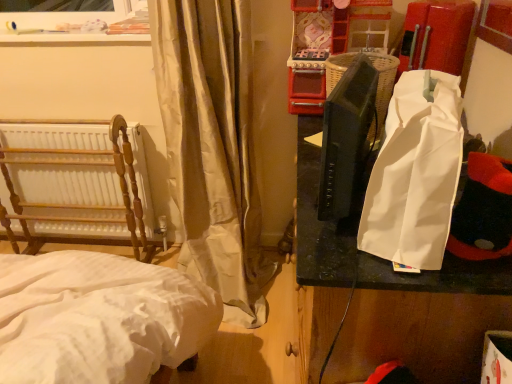
Describe the element at coordinates (75, 181) in the screenshot. I see `wooden radiator at left` at that location.

Where is `wooden radiator at left`? The width and height of the screenshot is (512, 384). wooden radiator at left is located at coordinates (75, 181).

Consider the image. In order to face white paper bag at right, should I rotate leftwards or rightwards?

Turn right by 20.603 degrees to look at white paper bag at right.

I want to click on wooden radiator at left, so click(75, 181).

Could you tell me if silky beige curtain at left is facing white paper bag at right?

No, silky beige curtain at left is not oriented towards white paper bag at right.

In terms of width, does silky beige curtain at left look wider or thinner when compared to white paper bag at right?

Clearly, silky beige curtain at left has more width compared to white paper bag at right.

Which of these two, silky beige curtain at left or white paper bag at right, is smaller?

white paper bag at right is smaller.

Looking at this image, is silky beige curtain at left taller or shorter than white paper bag at right?

Considering their sizes, silky beige curtain at left has more height than white paper bag at right.

Is white paper bag at right completely or partially outside of white paper bag at right?

Indeed, white paper bag at right is completely outside white paper bag at right.

Is the surface of white paper bag at right in direct contact with white paper bag at right?

No, white paper bag at right is not next to white paper bag at right.

Identify the location of table that appears on the right of white paper bag at right. This screenshot has height=384, width=512. (423, 319).

From a real-world perspective, is wooden radiator at left physically above silky beige curtain at left?

Actually, wooden radiator at left is physically below silky beige curtain at left in the real world.

Find the location of a particular element. furniture behind the silky beige curtain at left is located at coordinates (75, 181).

Is wooden radiator at left in front of or behind silky beige curtain at left in the image?

wooden radiator at left is positioned farther from the viewer than silky beige curtain at left.

Which object is thinner, wooden radiator at left or silky beige curtain at left?

Thinner between the two is wooden radiator at left.

Is wooden radiator at left in front of white paper bag at right?

No, wooden radiator at left is further to the viewer.

Does wooden radiator at left have a lesser width compared to white paper bag at right?

Correct, the width of wooden radiator at left is less than that of white paper bag at right.

From a real-world perspective, relative to white paper bag at right, is wooden radiator at left vertically above or below?

In terms of real-world spatial position, wooden radiator at left is below white paper bag at right.

Are wooden radiator at left and white paper bag at right far apart?

Yes.

Looking at this image, from a real-world perspective, is silky beige curtain at left above or below wooden radiator at left?

From a real-world perspective, silky beige curtain at left is physically above wooden radiator at left.

Looking at this image, is silky beige curtain at left oriented away from wooden radiator at left?

No, wooden radiator at left is not at the back of silky beige curtain at left.

Is the depth of silky beige curtain at left less than that of wooden radiator at left?

Yes, silky beige curtain at left is closer to the viewer.

How many degrees apart are the facing directions of silky beige curtain at left and wooden radiator at left?

There is a 0.114-degree angle between the facing directions of silky beige curtain at left and wooden radiator at left.

From the picture: Who is taller, white paper bag at right or white paper bag at right?

Standing taller between the two is white paper bag at right.

From a real-world perspective, is white paper bag at right below white paper bag at right?

Incorrect, from a real-world perspective, white paper bag at right is higher than white paper bag at right.

Is point (423, 228) less distant than point (505, 284)?

Yes, it is in front of point (505, 284).

Find the location of a particular element. Image resolution: width=512 pixels, height=384 pixels. table below the white paper bag at right (from the image's perspective) is located at coordinates (423, 319).

Does point (124, 192) come farther from viewer compared to point (384, 173)?

Yes, it is behind point (384, 173).

From the image's perspective, would you say wooden radiator at left is positioned over white paper bag at right?

No, from the image's perspective, wooden radiator at left is not above white paper bag at right.

From a real-world perspective, which is physically below, wooden radiator at left or white paper bag at right?

wooden radiator at left.

Locate an element on the screen. shopping bag lying on the right of silky beige curtain at left is located at coordinates (415, 173).

Identify the location of shopping bag above the white paper bag at right (from a real-world perspective). (415, 173).

From the image, which object appears to be farther from silky beige curtain at left, wooden radiator at left or white paper bag at right?

white paper bag at right lies further to silky beige curtain at left than the other object.

Estimate the real-world distances between objects in this image. Which object is further from silky beige curtain at left, white paper bag at right or white paper bag at right?

white paper bag at right lies further to silky beige curtain at left than the other object.

From the image, which object appears to be nearer to white paper bag at right, white paper bag at right or wooden radiator at left?

white paper bag at right lies closer to white paper bag at right than the other object.

From the image, which object appears to be farther from wooden radiator at left, silky beige curtain at left or white paper bag at right?

Based on the image, white paper bag at right appears to be further to wooden radiator at left.

In the scene shown: From the image, which object appears to be farther from white paper bag at right, silky beige curtain at left or wooden radiator at left?

wooden radiator at left is further to white paper bag at right.

Considering their positions, is white paper bag at right positioned closer to wooden radiator at left than white paper bag at right?

Among the two, white paper bag at right is located nearer to wooden radiator at left.

Estimate the real-world distances between objects in this image. Which object is closer to white paper bag at right, wooden radiator at left or white paper bag at right?

white paper bag at right is positioned closer to the anchor white paper bag at right.

From the image, which object appears to be nearer to white paper bag at right, white paper bag at right or wooden radiator at left?

white paper bag at right lies closer to white paper bag at right than the other object.

The image size is (512, 384). I want to click on curtain situated between wooden radiator at left and white paper bag at right from left to right, so click(212, 146).

You are a GUI agent. You are given a task and a screenshot of the screen. Output one action in this format:
    pyautogui.click(x=<x>, y=<y>)
    Task: Click on the shopping bag located between silky beige curtain at left and white paper bag at right in the left-right direction
    This screenshot has width=512, height=384.
    Given the screenshot: What is the action you would take?
    pyautogui.click(x=415, y=173)

Where is `curtain between wooden radiator at left and white paper bag at right in the horizontal direction`? This screenshot has width=512, height=384. curtain between wooden radiator at left and white paper bag at right in the horizontal direction is located at coordinates (212, 146).

Find the location of `shopping bag between wooden radiator at left and white paper bag at right from left to right`. shopping bag between wooden radiator at left and white paper bag at right from left to right is located at coordinates (415, 173).